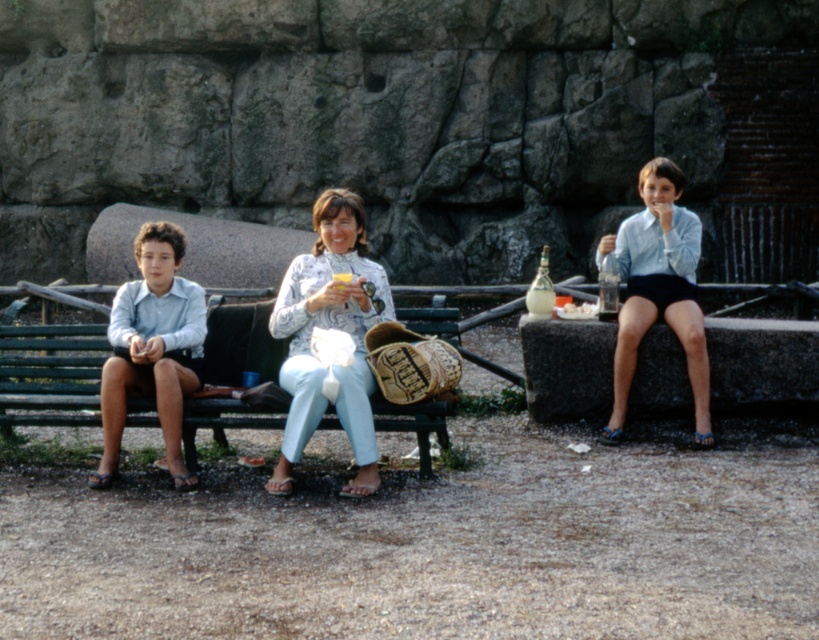
The height and width of the screenshot is (640, 819). Describe the element at coordinates (335, 326) in the screenshot. I see `light blue denim jeans at center` at that location.

Is light blue denim jeans at center in front of white paper napkin at center?

That is True.

Which is behind, point (129, 378) or point (351, 275)?

Point (351, 275)

The height and width of the screenshot is (640, 819). Find the location of `light blue denim jeans at center`. light blue denim jeans at center is located at coordinates (335, 326).

Can you confirm if light blue denim jeans at center is smaller than light blue shirt at center?

Correct, light blue denim jeans at center occupies less space than light blue shirt at center.

Does light blue denim jeans at center have a lesser height compared to light blue shirt at center?

Correct, light blue denim jeans at center is not as tall as light blue shirt at center.

Who is more distant from viewer, [192,342] or [625,336]?

The point [625,336] is more distant.

The image size is (819, 640). Identify the location of light blue denim jeans at center. (335, 326).

Can you confirm if patterned fabric blouse at center is bigger than white paper napkin at center?

Indeed, patterned fabric blouse at center has a larger size compared to white paper napkin at center.

Who is taller, patterned fabric blouse at center or white paper napkin at center?

With more height is patterned fabric blouse at center.

Is point (305, 285) positioned before point (340, 282)?

No, (305, 285) is further to viewer.

This screenshot has width=819, height=640. Identify the location of patterned fabric blouse at center. (329, 326).